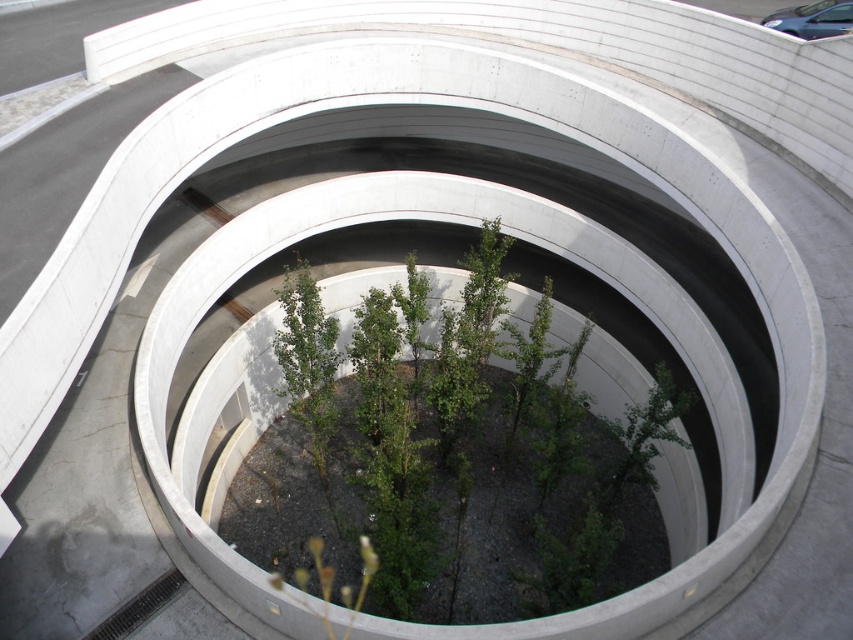
Is green leafy plant at center below metallic gray car at upper right?

Yes, green leafy plant at center is below metallic gray car at upper right.

Image resolution: width=853 pixels, height=640 pixels. I want to click on green leafy plant at center, so click(454, 458).